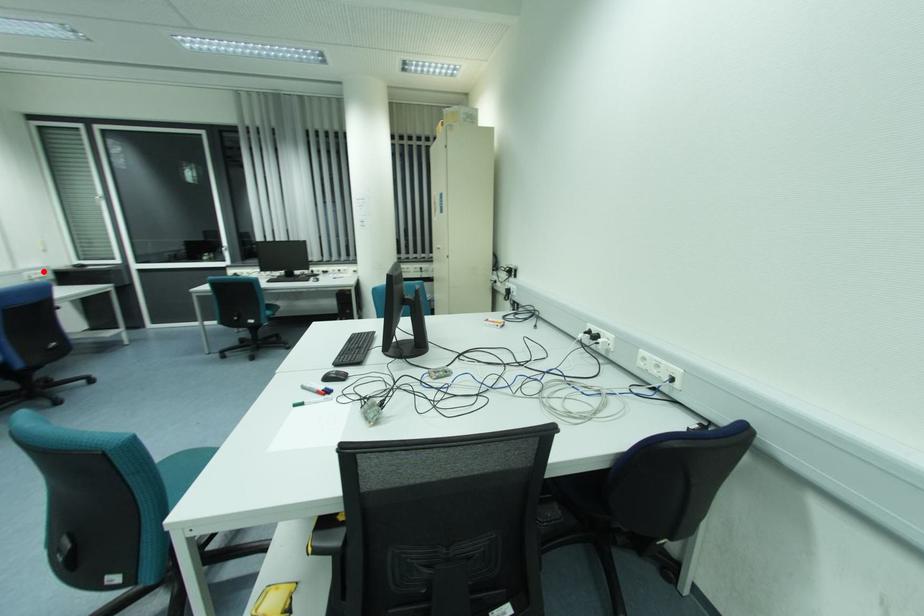
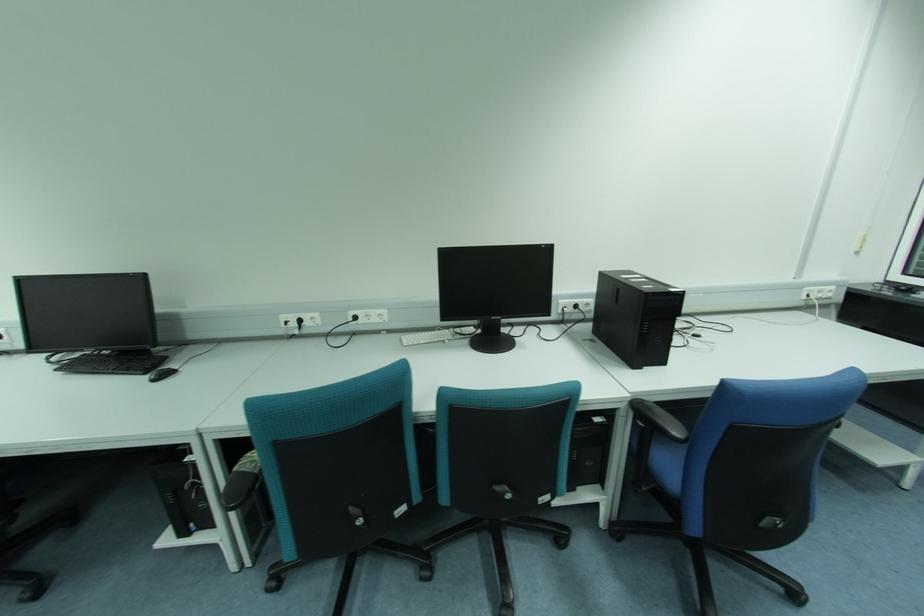
Question: I am providing you with two images of the same scene from different viewpoints. Image1 has a red point marked. In image2, the corresponding 3D location appears at what relative position? Reply with the corresponding letter.

Choices:
 (A) Closer
 (B) Farther

Answer: (A)